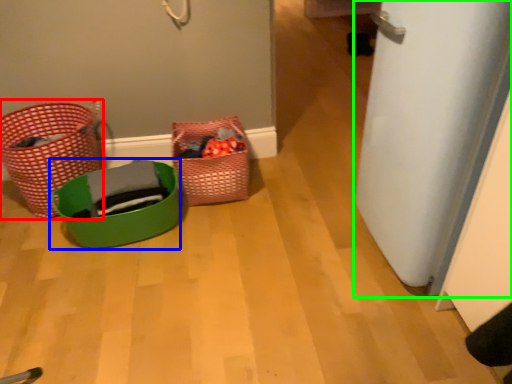
Question: Estimate the real-world distances between objects in this image. Which object is closer to basket (highlighted by a red box), basket (highlighted by a blue box) or door (highlighted by a green box)?

Choices:
 (A) basket
 (B) door

Answer: (A)